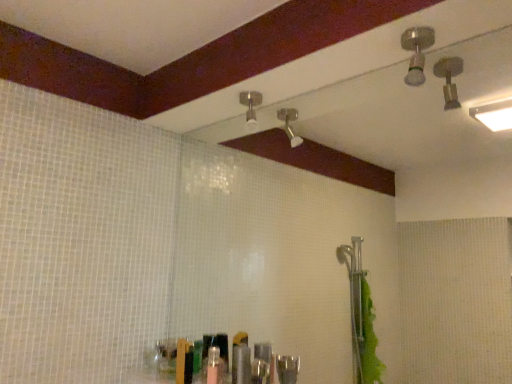
Question: In the image, is matte silver shower head at upper center, the 2th shower in the front-to-back sequence, positioned in front of or behind brushed metal shower head at upper right, positioned as the 1th shower in front-to-back order?

Choices:
 (A) front
 (B) behind

Answer: (B)

Question: From a real-world perspective, is matte silver shower head at upper center, which appears as the 1th shower when viewed from the back, physically located above or below brushed metal shower head at upper right, acting as the 2th shower starting from the left?

Choices:
 (A) above
 (B) below

Answer: (B)

Question: Based on their relative distances, which object is farther from the metallic silver toiletries at center?

Choices:
 (A) brushed metal shower head at upper right, marked as the 2th shower in a back-to-front arrangement
 (B) matte silver shower head at upper center, the 1th shower from the left

Answer: (A)

Question: Which of these objects is positioned closest to the brushed metal shower head at upper right, marked as the 2th shower in a back-to-front arrangement?

Choices:
 (A) matte silver shower head at upper center, which appears as the 1th shower when viewed from the back
 (B) metallic silver toiletries at center

Answer: (A)